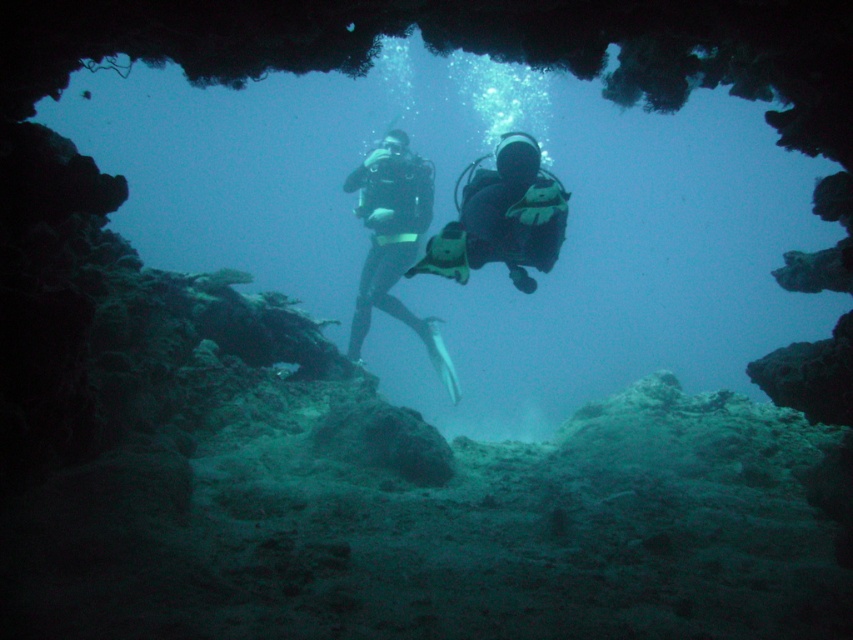
You are a scuba diver inside an underwater cave. You see two points marked in the scene. The first point is at coordinates point (520, 193) and the second point is at point (373, 216). If you want to swim towards the point that is closer to the entrance of the cave, which point should you head towards?

Point (520, 193) is in front of point (373, 216), so if you want to swim towards the entrance of the cave, you should head towards point (520, 193) since it is closer to the entrance.

You are a marine biologist observing the underwater cave scene. You notice two objects labeled as the black matte wetsuit at center and the black matte scuba diver at center. Which object is closer to the entrance of the cave?

The black matte wetsuit at center is closer to the entrance of the cave because it is in front of the black matte scuba diver at center.

You are a scuba diver preparing to enter an underwater cave. You see the point marked at coordinates (502,218). What object is located at that point?

The point at coordinates (502,218) marks the location of the black matte wetsuit at center.